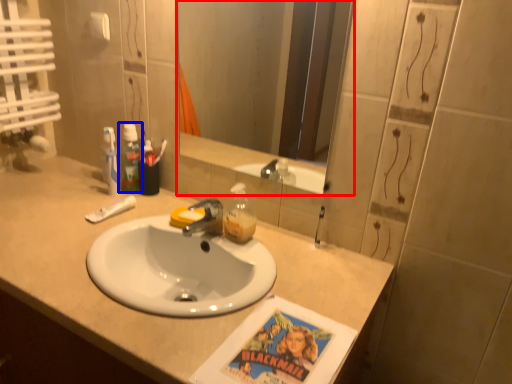
Question: Which object appears closest to the camera in this image, mirror (highlighted by a red box) or mouthwash (highlighted by a blue box)?

Choices:
 (A) mirror
 (B) mouthwash

Answer: (A)